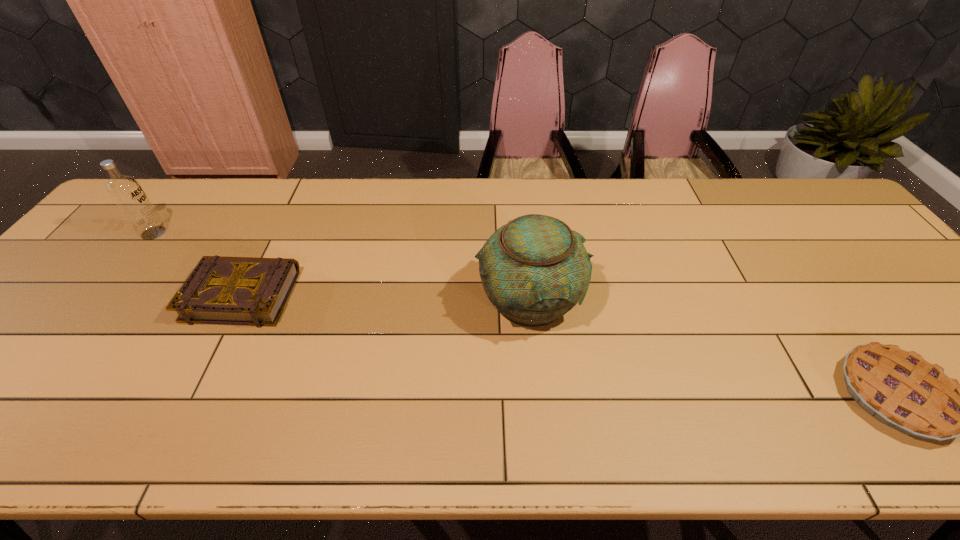
You are a GUI agent. You are given a task and a screenshot of the screen. Output one action in this format:
    pyautogui.click(x=<x>, y=<y>)
    Task: Click on the free space at the near edge of the desktop
    Image resolution: width=960 pixels, height=540 pixels.
    Given the screenshot: What is the action you would take?
    pyautogui.click(x=749, y=411)

This screenshot has height=540, width=960. Find the location of `vacant space at the left edge of the desktop`. vacant space at the left edge of the desktop is located at coordinates (108, 269).

At what (x,y) coordinates should I click in order to perform the action: click on vacant space at the right edge of the desktop. Please return your answer as a coordinate pair (x, y). Looking at the image, I should click on (871, 269).

The height and width of the screenshot is (540, 960). I want to click on vacant space at the far right corner of the desktop, so click(x=816, y=183).

At what (x,y) coordinates should I click in order to perform the action: click on vacant space that's between the second object from right to left and the leftmost object. Please return your answer as a coordinate pair (x, y). Looking at the image, I should click on (341, 266).

Locate an element on the screen. The image size is (960, 540). free space between the third object from right to left and the pottery is located at coordinates (386, 298).

At what (x,y) coordinates should I click in order to perform the action: click on empty space between the hardback book and the third object from left to right. Please return your answer as a coordinate pair (x, y). Looking at the image, I should click on (386, 298).

Where is `object that is the closest to the pie`? The height and width of the screenshot is (540, 960). object that is the closest to the pie is located at coordinates (534, 269).

Where is `the second closest object to the shortest object`? The width and height of the screenshot is (960, 540). the second closest object to the shortest object is located at coordinates (251, 291).

At what (x,y) coordinates should I click in order to perform the action: click on vacant space that satisfies the following two spatial constraints: 1. on the front label of the leftmost object; 2. on the back side of the second object from left to right. Please return your answer as a coordinate pair (x, y). Looking at the image, I should click on (105, 295).